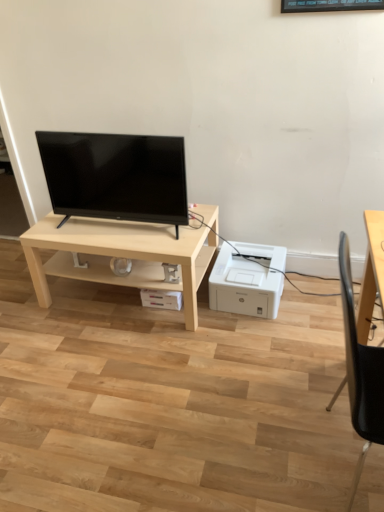
Question: Is black plastic chair at right far away from light wood table at center?

Choices:
 (A) no
 (B) yes

Answer: (B)

Question: From a real-world perspective, is black plastic chair at right located beneath light wood table at center?

Choices:
 (A) no
 (B) yes

Answer: (A)

Question: Are black plastic chair at right and light wood table at center making contact?

Choices:
 (A) yes
 (B) no

Answer: (B)

Question: Is black plastic chair at right further to camera compared to light wood table at center?

Choices:
 (A) no
 (B) yes

Answer: (A)

Question: Can you confirm if black plastic chair at right is positioned to the right of light wood table at center?

Choices:
 (A) no
 (B) yes

Answer: (B)

Question: Is black glossy tv at center inside or outside of black plastic chair at right?

Choices:
 (A) outside
 (B) inside

Answer: (A)

Question: In terms of height, does black glossy tv at center look taller or shorter compared to black plastic chair at right?

Choices:
 (A) short
 (B) tall

Answer: (A)

Question: Considering the positions of point (183, 164) and point (370, 413), is point (183, 164) closer or farther from the camera than point (370, 413)?

Choices:
 (A) farther
 (B) closer

Answer: (A)

Question: Is black glossy tv at center to the left or to the right of black plastic chair at right in the image?

Choices:
 (A) right
 (B) left

Answer: (B)

Question: From a real-world perspective, is black plastic chair at right positioned above or below black glossy tv at center?

Choices:
 (A) above
 (B) below

Answer: (B)

Question: Is point (367, 394) positioned closer to the camera than point (102, 188)?

Choices:
 (A) closer
 (B) farther

Answer: (A)

Question: Looking at the image, does black plastic chair at right seem bigger or smaller compared to black glossy tv at center?

Choices:
 (A) small
 (B) big

Answer: (B)

Question: Is black plastic chair at right taller or shorter than black glossy tv at center?

Choices:
 (A) short
 (B) tall

Answer: (B)

Question: Which is correct: white plastic printer at lower right is inside black plastic chair at right, or outside of it?

Choices:
 (A) outside
 (B) inside

Answer: (A)

Question: Is point (274, 284) positioned closer to the camera than point (372, 351)?

Choices:
 (A) farther
 (B) closer

Answer: (A)